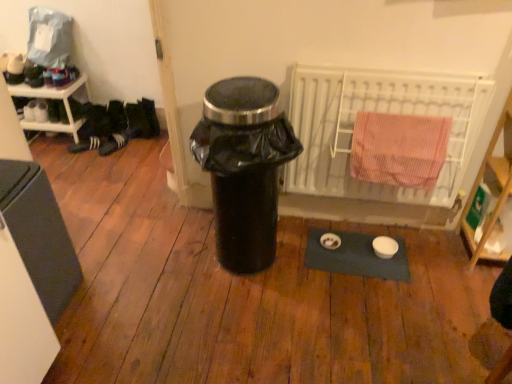
Identify the location of empty space that is in between white textured shoe at left, which is the first shoe from right to left, and black matte shoe at left, which is counted as the 2th shoe, starting from the right. Image resolution: width=512 pixels, height=384 pixels. (82, 150).